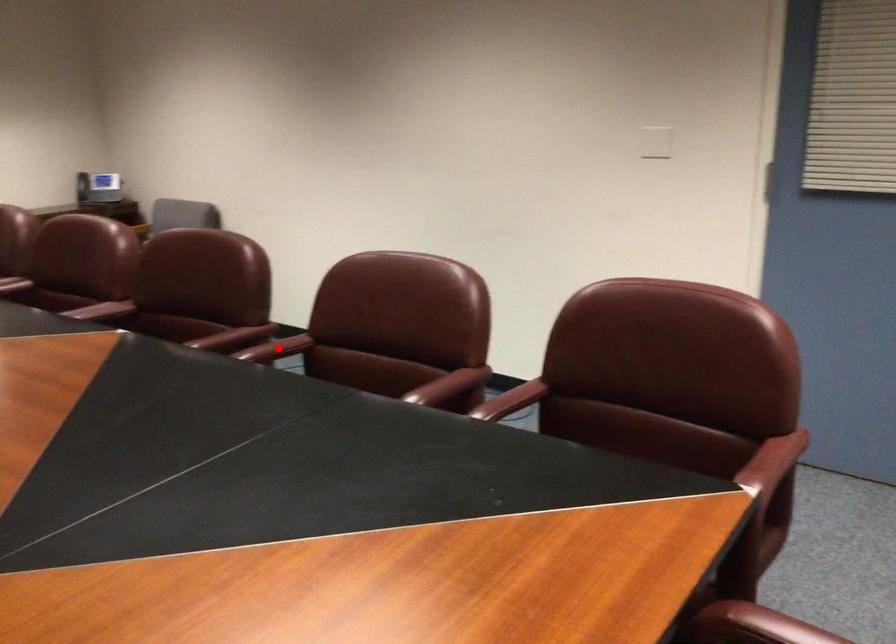
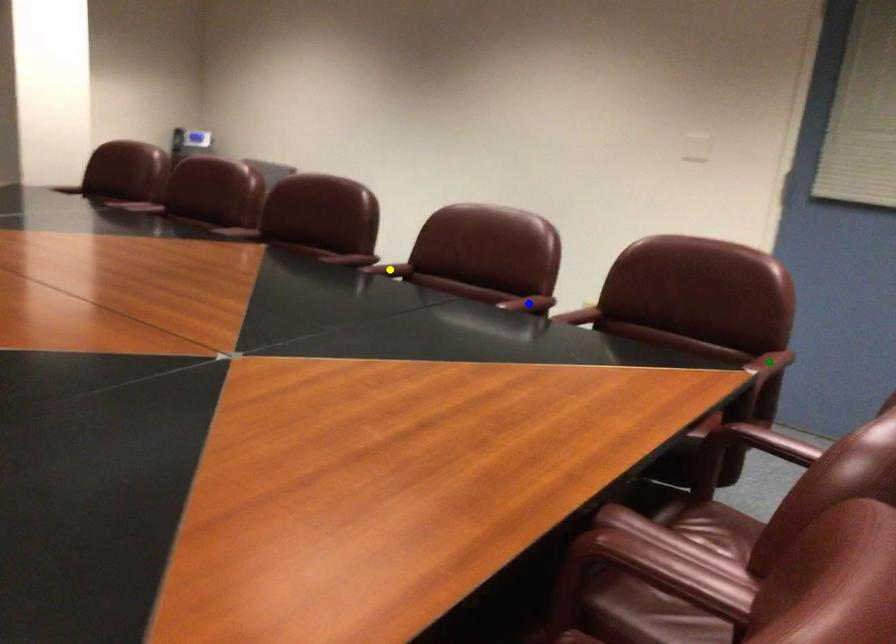
Question: I am providing you with two images of the same scene from different viewpoints. A red point is marked on the first image. You are given multiple points on the second image. Can you choose the point in image 2 that corresponds to the point in image 1?

Choices:
 (A) yellow point
 (B) blue point
 (C) green point

Answer: (A)